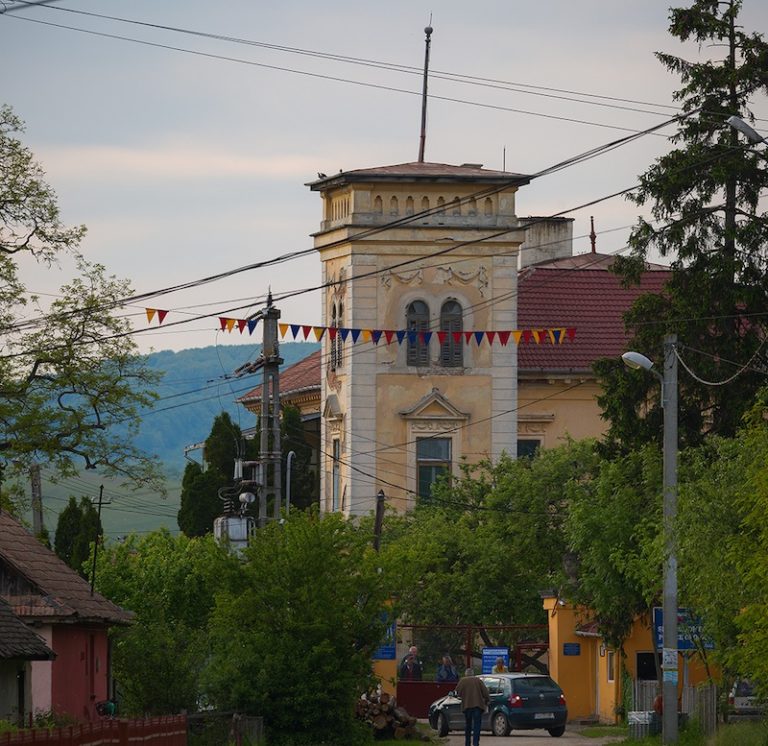
Identify the location of yellow wal. (583, 677), (386, 671).